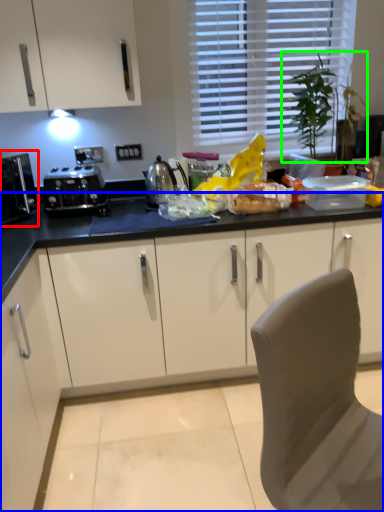
Question: Considering the real-world distances, which object is closest to kitchen appliance (highlighted by a red box)? cabinetry (highlighted by a blue box) or plant (highlighted by a green box).

Choices:
 (A) cabinetry
 (B) plant

Answer: (A)